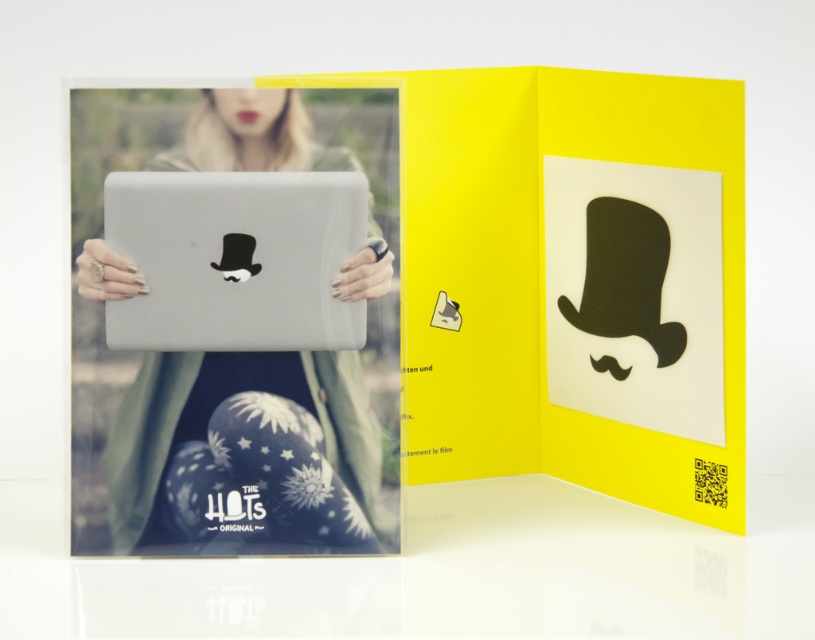
Question: Is blonde hair at center wider than satin silver laptop at center?

Choices:
 (A) no
 (B) yes

Answer: (B)

Question: Does blonde hair at center appear on the right side of satin silver laptop at center?

Choices:
 (A) no
 (B) yes

Answer: (B)

Question: Which object is farther from the camera taking this photo?

Choices:
 (A) satin silver laptop at center
 (B) blonde hair at center

Answer: (B)

Question: Can you confirm if blonde hair at center is bigger than satin silver laptop at center?

Choices:
 (A) no
 (B) yes

Answer: (B)

Question: Among these objects, which one is nearest to the camera?

Choices:
 (A) satin silver laptop at center
 (B) blonde hair at center

Answer: (A)

Question: Which point appears closest to the camera in this image?

Choices:
 (A) (139, 522)
 (B) (148, 324)

Answer: (B)